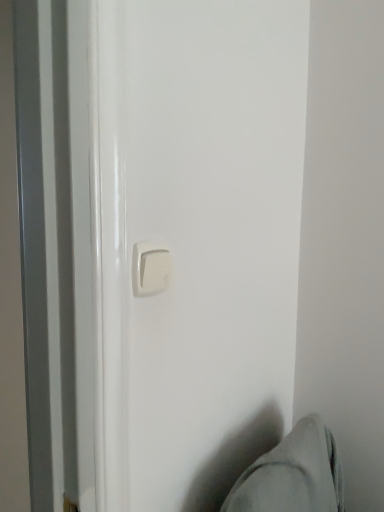
This screenshot has height=512, width=384. What are the coordinates of `white plastic door handle at center` in the screenshot? It's located at (150, 268).

The width and height of the screenshot is (384, 512). What do you see at coordinates (150, 268) in the screenshot?
I see `white plastic door handle at center` at bounding box center [150, 268].

The height and width of the screenshot is (512, 384). What do you see at coordinates (293, 475) in the screenshot?
I see `gray fabric swivel chair at lower right` at bounding box center [293, 475].

This screenshot has width=384, height=512. What are the coordinates of `gray fabric swivel chair at lower right` in the screenshot? It's located at (293, 475).

Where is `white plastic door handle at center`? white plastic door handle at center is located at coordinates (150, 268).

Considering the relative positions of white plastic door handle at center and gray fabric swivel chair at lower right in the image provided, is white plastic door handle at center to the left of gray fabric swivel chair at lower right from the viewer's perspective?

Correct, you'll find white plastic door handle at center to the left of gray fabric swivel chair at lower right.

Which is behind, white plastic door handle at center or gray fabric swivel chair at lower right?

white plastic door handle at center.

Which is closer, (152, 259) or (287, 473)?

Clearly, point (152, 259) is closer to the camera than point (287, 473).

From the image's perspective, which object appears higher, white plastic door handle at center or gray fabric swivel chair at lower right?

From the image's view, white plastic door handle at center is above.

From a real-world perspective, between white plastic door handle at center and gray fabric swivel chair at lower right, who is vertically higher?

white plastic door handle at center is physically above.

Which object is thinner, white plastic door handle at center or gray fabric swivel chair at lower right?

white plastic door handle at center.

Does white plastic door handle at center have a greater height compared to gray fabric swivel chair at lower right?

Incorrect, the height of white plastic door handle at center is not larger of that of gray fabric swivel chair at lower right.

Which of these two, white plastic door handle at center or gray fabric swivel chair at lower right, is smaller?

With smaller size is white plastic door handle at center.

Is white plastic door handle at center not inside gray fabric swivel chair at lower right?

white plastic door handle at center lies outside gray fabric swivel chair at lower right's area.

Is white plastic door handle at center not near gray fabric swivel chair at lower right?

white plastic door handle at center is near gray fabric swivel chair at lower right, not far away.

Is gray fabric swivel chair at lower right at the back of white plastic door handle at center?

No, white plastic door handle at center is not facing away from gray fabric swivel chair at lower right.

Image resolution: width=384 pixels, height=512 pixels. I want to click on swivel chair below the white plastic door handle at center (from a real-world perspective), so click(293, 475).

Looking at this image, which object is positioned more to the left, gray fabric swivel chair at lower right or white plastic door handle at center?

From the viewer's perspective, white plastic door handle at center appears more on the left side.

Who is more distant, gray fabric swivel chair at lower right or white plastic door handle at center?

white plastic door handle at center is more distant.

Which is in front, point (254, 511) or point (134, 276)?

Point (134, 276)

From the image's perspective, which is below, gray fabric swivel chair at lower right or white plastic door handle at center?

gray fabric swivel chair at lower right.

From a real-world perspective, who is located lower, gray fabric swivel chair at lower right or white plastic door handle at center?

In real-world perspective, gray fabric swivel chair at lower right is lower.

Does gray fabric swivel chair at lower right have a greater width compared to white plastic door handle at center?

Indeed, gray fabric swivel chair at lower right has a greater width compared to white plastic door handle at center.

Can you confirm if gray fabric swivel chair at lower right is shorter than white plastic door handle at center?

No.

Is gray fabric swivel chair at lower right smaller than white plastic door handle at center?

Actually, gray fabric swivel chair at lower right might be larger than white plastic door handle at center.

Is gray fabric swivel chair at lower right not within white plastic door handle at center?

Absolutely, gray fabric swivel chair at lower right is external to white plastic door handle at center.

Is gray fabric swivel chair at lower right in contact with white plastic door handle at center?

No, gray fabric swivel chair at lower right is not beside white plastic door handle at center.

Is gray fabric swivel chair at lower right oriented away from white plastic door handle at center?

gray fabric swivel chair at lower right is not turned away from white plastic door handle at center.

Where is `door handle on the left of gray fabric swivel chair at lower right`? The width and height of the screenshot is (384, 512). door handle on the left of gray fabric swivel chair at lower right is located at coordinates (150, 268).

Where is `swivel chair on the right of white plastic door handle at center`? The image size is (384, 512). swivel chair on the right of white plastic door handle at center is located at coordinates (293, 475).

Image resolution: width=384 pixels, height=512 pixels. I want to click on swivel chair in front of the white plastic door handle at center, so click(x=293, y=475).